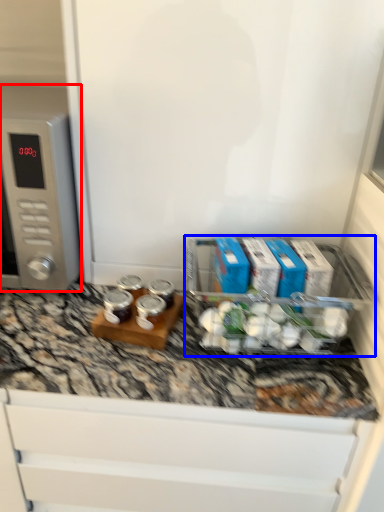
Question: Which object is further to the camera taking this photo, home appliance (highlighted by a red box) or appliance (highlighted by a blue box)?

Choices:
 (A) home appliance
 (B) appliance

Answer: (A)